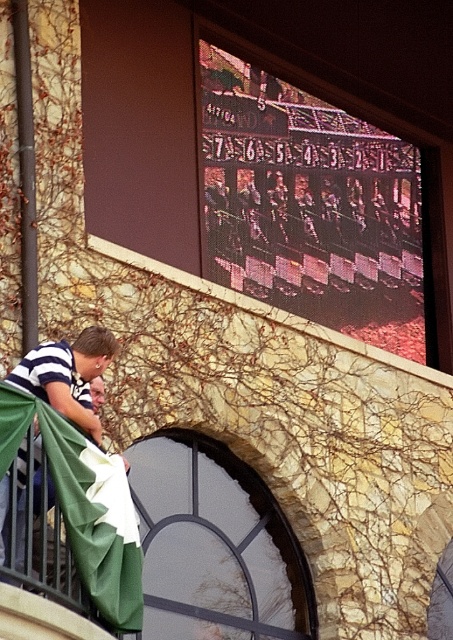
You are standing on a balcony overlooking a sports event. You see a striped cotton shirt at lower left and a green fabric flag at lower left. Which object is closer to the edge of the balcony?

The striped cotton shirt at lower left is located above the green fabric flag at lower left, so the green fabric flag at lower left is closer to the edge of the balcony.

You are at a sports event and see two items at the lower left corner of the image. Which one is positioned more to the left between the striped cotton shirt at lower left and the green fabric flag at lower left?

The striped cotton shirt at lower left is positioned more to the left than the green fabric flag at lower left.

You are standing at the center of the scene and want to locate the striped cotton shirt at lower left. Which direction should you look to find it?

The striped cotton shirt at lower left is located at point 0.588 on the x axis and 0.152 on the y axis, so you should look to the lower left direction to find it.